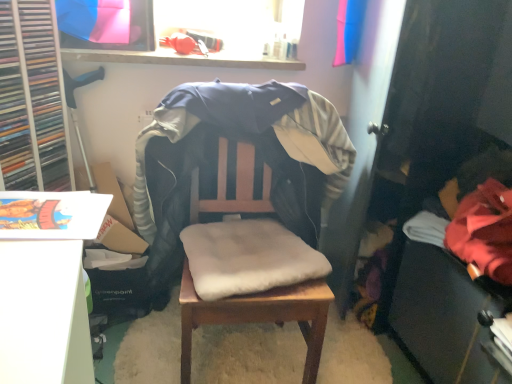
Question: Is soft beige cushion at center in front of or behind wooden chair with cushion at center in the image?

Choices:
 (A) behind
 (B) front

Answer: (A)

Question: Is soft beige cushion at center taller or shorter than wooden chair with cushion at center?

Choices:
 (A) tall
 (B) short

Answer: (B)

Question: Which object is the closest to the wooden chair with cushion at center?

Choices:
 (A) red fleece jacket at lower right
 (B) wooden table at center
 (C) soft beige cushion at center

Answer: (B)

Question: Considering the real-world distances, which object is farthest from the wooden chair with cushion at center?

Choices:
 (A) soft beige cushion at center
 (B) red fleece jacket at lower right
 (C) wooden table at center

Answer: (B)